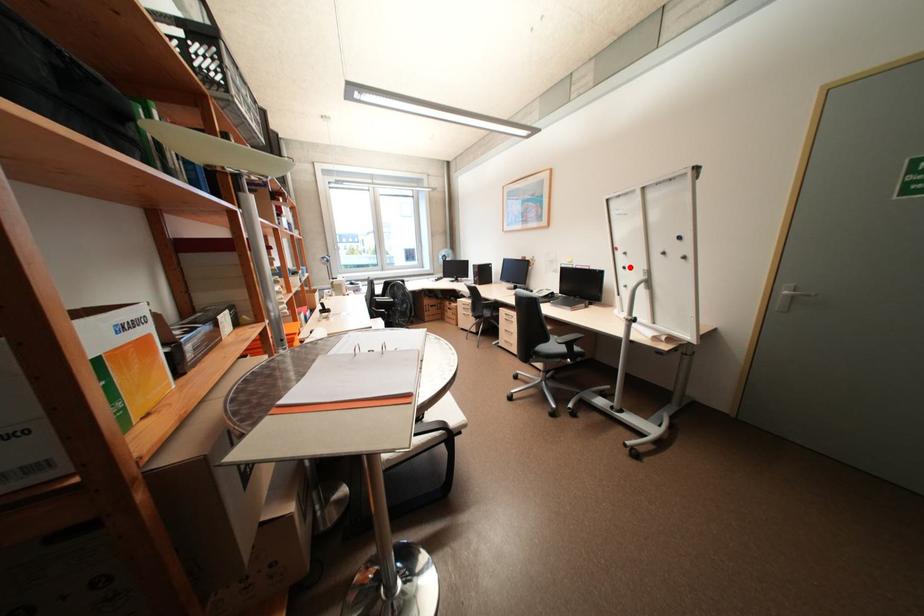
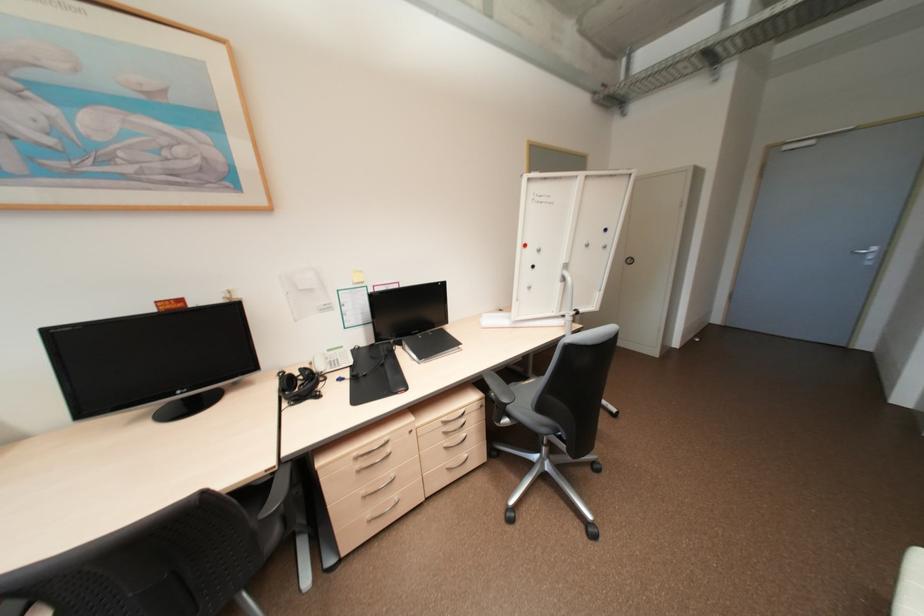
Where in the second image is the point corresponding to the highlighted location from the first image?

(539, 265)